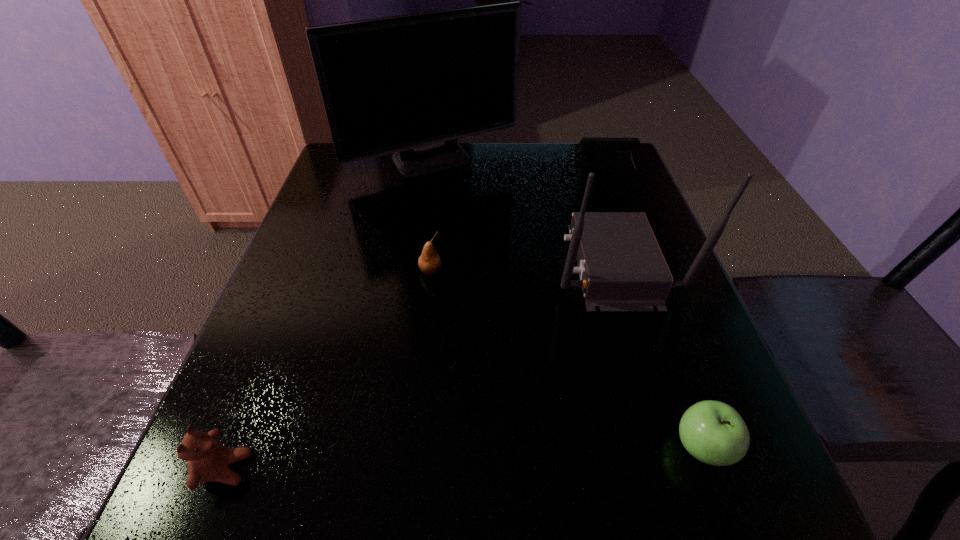
Locate an element on the screen. Image resolution: width=960 pixels, height=540 pixels. object identified as the second closest to the pear is located at coordinates (412, 84).

Select which object appears as the third closest to the teddy bear. Please provide its 2D coordinates. Your answer should be formatted as a tuple, i.e. [(x, y)], where the tuple contains the x and y coordinates of a point satisfying the conditions above.

[(713, 432)]

Locate an element on the screen. free space in the image that satisfies the following two spatial constraints: 1. on the back of the apple to connect cables; 2. on the left side of the second tallest object is located at coordinates (669, 448).

Where is `free space that satisfies the following two spatial constraints: 1. on the front-facing side of the computer monitor; 2. on the right side of the apple`? free space that satisfies the following two spatial constraints: 1. on the front-facing side of the computer monitor; 2. on the right side of the apple is located at coordinates (393, 448).

I want to click on free region that satisfies the following two spatial constraints: 1. on the front-facing side of the pear; 2. on the left side of the computer monitor, so click(x=418, y=271).

Find the location of a particular element. vacant area that satisfies the following two spatial constraints: 1. on the back of the apple to connect cables; 2. on the left side of the second tallest object is located at coordinates (669, 448).